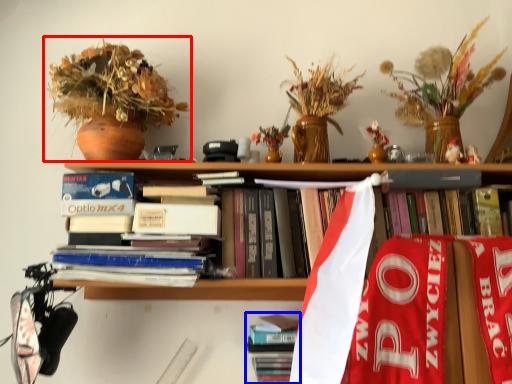
Question: Which object is further to the camera taking this photo, houseplant (highlighted by a red box) or book (highlighted by a blue box)?

Choices:
 (A) houseplant
 (B) book

Answer: (B)